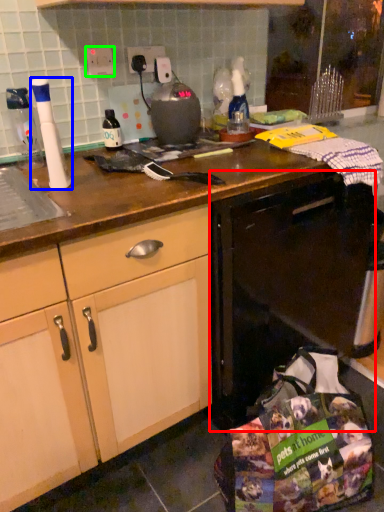
Question: Which object is the closest to the dish washer (highlighted by a red box)? Choose among these: kitchen appliance (highlighted by a blue box) or electric outlet (highlighted by a green box).

Choices:
 (A) kitchen appliance
 (B) electric outlet

Answer: (A)